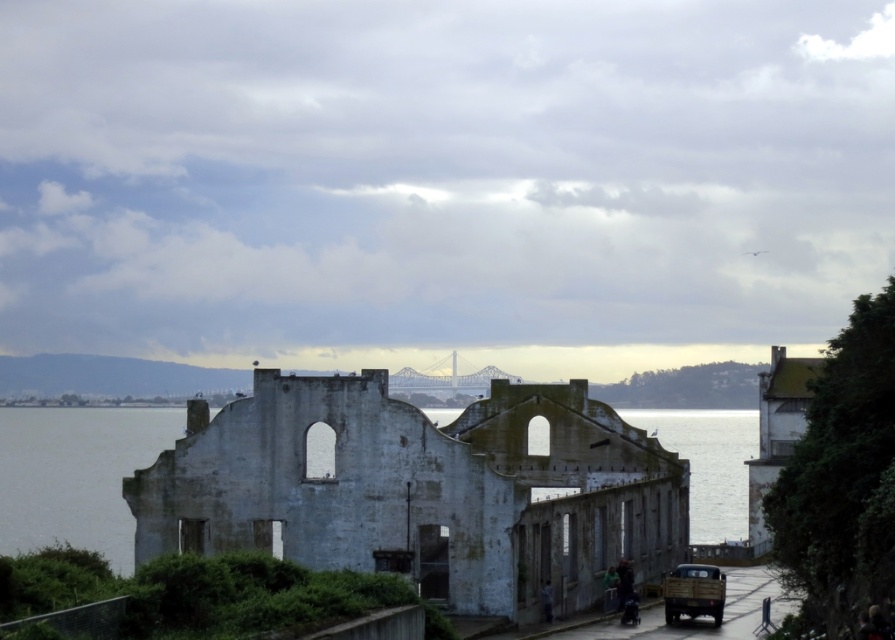
Is point (619, 577) more distant than point (612, 596)?

No, it is not.

Is dark hair at lower center to the right of green fabric jacket at lower center from the viewer's perspective?

Yes, dark hair at lower center is to the right of green fabric jacket at lower center.

Between point (619, 604) and point (604, 600), which one is positioned in front?

Point (619, 604) is more forward.

This screenshot has height=640, width=895. I want to click on dark hair at lower center, so 624,580.

Which of these two, matte brown truck at lower right or dark hair at lower center, stands shorter?

Standing shorter between the two is dark hair at lower center.

Is the position of matte brown truck at lower right more distant than that of dark hair at lower center?

No, it is not.

Is point (687, 566) in front of point (625, 589)?

Yes.

I want to click on matte brown truck at lower right, so click(x=695, y=593).

Does white weathered stone ruins at center have a larger size compared to matte brown truck at lower right?

Indeed, white weathered stone ruins at center has a larger size compared to matte brown truck at lower right.

Which is behind, point (521, 388) or point (682, 595)?

The point (521, 388) is more distant.

The height and width of the screenshot is (640, 895). Describe the element at coordinates (422, 490) in the screenshot. I see `white weathered stone ruins at center` at that location.

Find the location of `white weathered stone ruins at center`. white weathered stone ruins at center is located at coordinates (422, 490).